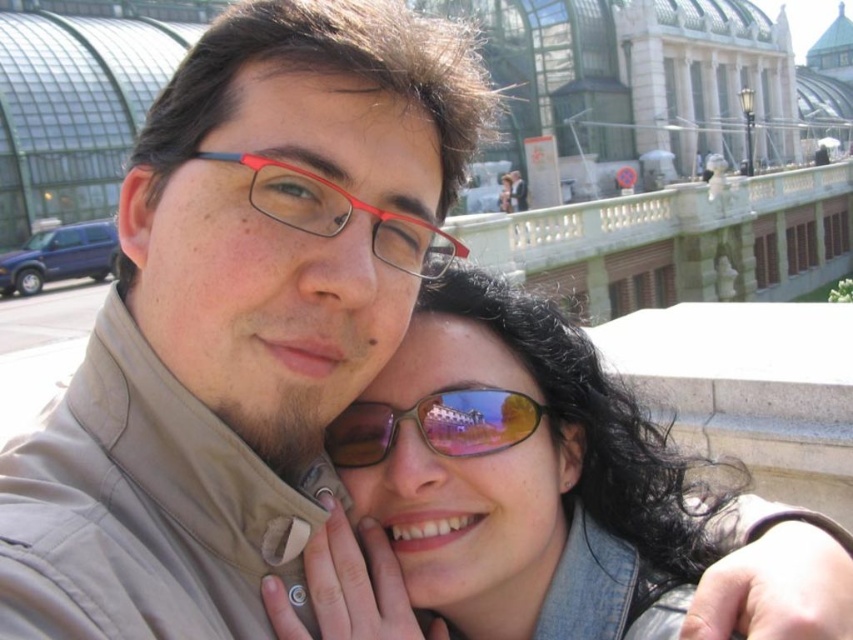
What do you see at coordinates (434, 424) in the screenshot? Image resolution: width=853 pixels, height=640 pixels. I see `brown reflective sunglasses at center` at bounding box center [434, 424].

Is brown reflective sunglasses at center shorter than matte plastic glasses at center?

Correct, brown reflective sunglasses at center is not as tall as matte plastic glasses at center.

Identify the location of brown reflective sunglasses at center. This screenshot has height=640, width=853. (434, 424).

Identify the location of brown reflective sunglasses at center. (434, 424).

Is matte beige jacket at center wider than brown reflective sunglasses at center?

Indeed, matte beige jacket at center has a greater width compared to brown reflective sunglasses at center.

Which is more to the right, matte beige jacket at center or brown reflective sunglasses at center?

Positioned to the right is brown reflective sunglasses at center.

At what (x,y) coordinates should I click in order to perform the action: click on matte beige jacket at center. Please return your answer as a coordinate pair (x, y). This screenshot has width=853, height=640. Looking at the image, I should click on (244, 332).

I want to click on matte beige jacket at center, so point(244,332).

Image resolution: width=853 pixels, height=640 pixels. Find the location of `matte beige jacket at center`. matte beige jacket at center is located at coordinates (244, 332).

Based on the photo, who is shorter, matte beige jacket at center or matte plastic glasses at center?

matte plastic glasses at center is shorter.

Is point (299, 381) closer to camera compared to point (460, 257)?

Yes, point (299, 381) is in front of point (460, 257).

The image size is (853, 640). I want to click on matte beige jacket at center, so (x=244, y=332).